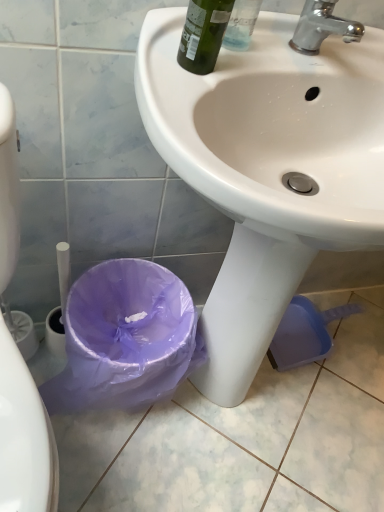
At what (x,y) coordinates should I click in order to perform the action: click on green glass bottle at upper center. Please return your answer as a coordinate pair (x, y). Image resolution: width=384 pixels, height=512 pixels. Looking at the image, I should click on (203, 34).

The height and width of the screenshot is (512, 384). What do you see at coordinates (267, 169) in the screenshot?
I see `white glossy sink at center` at bounding box center [267, 169].

Locate an element on the screen. chrome metallic faucet at upper right is located at coordinates (322, 27).

Locate an element on the screen. The image size is (384, 512). green glass bottle at upper center is located at coordinates (203, 34).

Which of these two, white glossy sink at center or green glass bottle at upper center, is smaller?

With smaller size is green glass bottle at upper center.

From the picture: From a real-world perspective, between white glossy sink at center and green glass bottle at upper center, who is vertically lower?

white glossy sink at center is physically lower.

Measure the distance from white glossy sink at center to green glass bottle at upper center.

white glossy sink at center and green glass bottle at upper center are 10.86 inches apart.

Is point (150, 90) closer to viewer compared to point (222, 35)?

Yes, it is in front of point (222, 35).

Is point (296, 27) positioned after point (175, 304)?

That is False.

Looking at the image, does chrome metallic faucet at upper right seem bigger or smaller compared to purple plastic bag at lower left?

Considering their sizes, chrome metallic faucet at upper right takes up less space than purple plastic bag at lower left.

This screenshot has height=512, width=384. In the image, there is a chrome metallic faucet at upper right. Identify the location of garbage below it (from a real-world perspective). (125, 338).

From the picture: Choose the correct answer: Is chrome metallic faucet at upper right inside purple plastic bag at lower left or outside it?

chrome metallic faucet at upper right is not inside purple plastic bag at lower left, it's outside.

Are green glass bottle at upper center and white glossy sink at center beside each other?

green glass bottle at upper center and white glossy sink at center are clearly separated.

Which of these two, green glass bottle at upper center or white glossy sink at center, stands taller?

white glossy sink at center.

Consider the image. Between green glass bottle at upper center and white glossy sink at center, which one appears on the right side from the viewer's perspective?

From the viewer's perspective, white glossy sink at center appears more on the right side.

Which object is further away from the camera taking this photo, green glass bottle at upper center or white glossy sink at center?

green glass bottle at upper center is further away from the camera.

Consider the image. In the image, is green glass bottle at upper center positioned in front of or behind chrome metallic faucet at upper right?

Clearly, green glass bottle at upper center is in front of chrome metallic faucet at upper right.

Is green glass bottle at upper center positioned far away from chrome metallic faucet at upper right?

They are positioned close to each other.

Does green glass bottle at upper center turn towards chrome metallic faucet at upper right?

No, green glass bottle at upper center is not facing towards chrome metallic faucet at upper right.

Is green glass bottle at upper center taller than chrome metallic faucet at upper right?

Yes, green glass bottle at upper center is taller than chrome metallic faucet at upper right.

Is purple plastic bag at lower left surrounding green glass bottle at upper center?

No, green glass bottle at upper center is not inside purple plastic bag at lower left.

Which of these two, purple plastic bag at lower left or green glass bottle at upper center, is thinner?

green glass bottle at upper center.

Does purple plastic bag at lower left appear on the right side of green glass bottle at upper center?

No, purple plastic bag at lower left is not to the right of green glass bottle at upper center.

Considering the sizes of objects chrome metallic faucet at upper right and white glossy sink at center in the image provided, who is wider, chrome metallic faucet at upper right or white glossy sink at center?

Wider between the two is white glossy sink at center.

Which is closer to the camera, (303, 29) or (314, 203)?

Positioned in front is point (314, 203).

Considering the relative positions of chrome metallic faucet at upper right and white glossy sink at center in the image provided, is chrome metallic faucet at upper right to the left of white glossy sink at center from the viewer's perspective?

No, chrome metallic faucet at upper right is not to the left of white glossy sink at center.

Relative to purple plastic bag at lower left, is white glossy sink at center in front or behind?

white glossy sink at center is in front of purple plastic bag at lower left.

Looking at this image, from the image's perspective, who appears lower, white glossy sink at center or purple plastic bag at lower left?

From the image's view, purple plastic bag at lower left is below.

Who is shorter, white glossy sink at center or purple plastic bag at lower left?

Standing shorter between the two is purple plastic bag at lower left.

Is the surface of white glossy sink at center in direct contact with purple plastic bag at lower left?

No, white glossy sink at center is not beside purple plastic bag at lower left.

Locate an element on the screen. Image resolution: width=384 pixels, height=512 pixels. sink in front of the green glass bottle at upper center is located at coordinates (267, 169).

You are a GUI agent. You are given a task and a screenshot of the screen. Output one action in this format:
    pyautogui.click(x=<x>, y=<y>)
    Task: Click on the garbage located behind the chrome metallic faucet at upper right
    This screenshot has width=384, height=512.
    Given the screenshot: What is the action you would take?
    pyautogui.click(x=125, y=338)

Estimate the real-world distances between objects in this image. Which object is further from purple plastic bag at lower left, green glass bottle at upper center or white glossy sink at center?

Based on the image, green glass bottle at upper center appears to be further to purple plastic bag at lower left.

Which object lies further to the anchor point purple plastic bag at lower left, green glass bottle at upper center or chrome metallic faucet at upper right?

chrome metallic faucet at upper right.

Based on their spatial positions, is green glass bottle at upper center or white glossy sink at center further from chrome metallic faucet at upper right?

white glossy sink at center is further to chrome metallic faucet at upper right.

Considering their positions, is white glossy sink at center positioned closer to purple plastic bag at lower left than green glass bottle at upper center?

white glossy sink at center is positioned closer to the anchor purple plastic bag at lower left.

Based on their spatial positions, is chrome metallic faucet at upper right or purple plastic bag at lower left closer to white glossy sink at center?

Among the two, purple plastic bag at lower left is located nearer to white glossy sink at center.

From the image, which object appears to be farther from green glass bottle at upper center, purple plastic bag at lower left or white glossy sink at center?

purple plastic bag at lower left is further to green glass bottle at upper center.

Based on their spatial positions, is purple plastic bag at lower left or chrome metallic faucet at upper right further from green glass bottle at upper center?

purple plastic bag at lower left lies further to green glass bottle at upper center than the other object.

Estimate the real-world distances between objects in this image. Which object is further from chrome metallic faucet at upper right, white glossy sink at center or purple plastic bag at lower left?

purple plastic bag at lower left lies further to chrome metallic faucet at upper right than the other object.

This screenshot has width=384, height=512. In order to click on bottle between chrome metallic faucet at upper right and purple plastic bag at lower left vertically in this screenshot , I will do `click(203, 34)`.

Locate an element on the screen. The image size is (384, 512). sink that lies between chrome metallic faucet at upper right and purple plastic bag at lower left from top to bottom is located at coordinates (267, 169).

Find the location of a particular element. sink between green glass bottle at upper center and purple plastic bag at lower left in the up-down direction is located at coordinates (267, 169).

Locate an element on the screen. bottle between chrome metallic faucet at upper right and white glossy sink at center in the up-down direction is located at coordinates (203, 34).